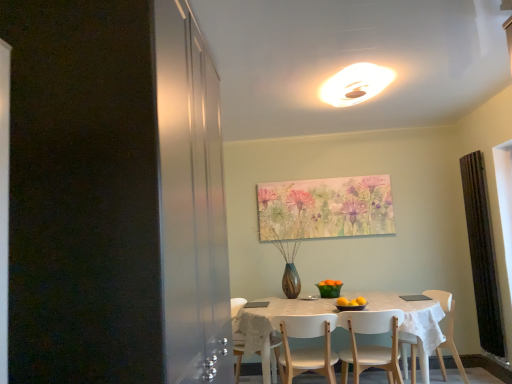
Question: Does white matte chair at lower center, which appears as the 2th chair when viewed from the right, appear on the left side of white glossy light fixture at upper center?

Choices:
 (A) no
 (B) yes

Answer: (A)

Question: Is white matte chair at lower center, marked as the 2th chair in a left-to-right arrangement, thinner than white glossy light fixture at upper center?

Choices:
 (A) yes
 (B) no

Answer: (A)

Question: Does white matte chair at lower center, marked as the 2th chair in a left-to-right arrangement, lie behind white glossy light fixture at upper center?

Choices:
 (A) yes
 (B) no

Answer: (B)

Question: From the image's perspective, would you say white matte chair at lower center, marked as the 2th chair in a left-to-right arrangement, is positioned over white glossy light fixture at upper center?

Choices:
 (A) yes
 (B) no

Answer: (B)

Question: Is white matte chair at lower center, marked as the 2th chair in a left-to-right arrangement, not within white glossy light fixture at upper center?

Choices:
 (A) no
 (B) yes

Answer: (B)

Question: Does white matte chair at lower center, which appears as the 2th chair when viewed from the right, have a greater height compared to white glossy light fixture at upper center?

Choices:
 (A) yes
 (B) no

Answer: (A)

Question: Is the surface of white matte chair at lower center, which appears as the 2th chair when viewed from the right, in direct contact with black textured curtain at right?

Choices:
 (A) no
 (B) yes

Answer: (A)

Question: Does white matte chair at lower center, marked as the 2th chair in a left-to-right arrangement, have a lesser width compared to black textured curtain at right?

Choices:
 (A) yes
 (B) no

Answer: (B)

Question: Is white matte chair at lower center, marked as the 2th chair in a left-to-right arrangement, oriented towards black textured curtain at right?

Choices:
 (A) no
 (B) yes

Answer: (A)

Question: Is white matte chair at lower center, marked as the 2th chair in a left-to-right arrangement, bigger than black textured curtain at right?

Choices:
 (A) yes
 (B) no

Answer: (A)

Question: Is white matte chair at lower center, marked as the 2th chair in a left-to-right arrangement, to the right of black textured curtain at right from the viewer's perspective?

Choices:
 (A) no
 (B) yes

Answer: (A)

Question: From a real-world perspective, is white matte chair at lower center, which appears as the 2th chair when viewed from the right, on black textured curtain at right?

Choices:
 (A) yes
 (B) no

Answer: (B)

Question: Is white glossy light fixture at upper center further to camera compared to black textured curtain at right?

Choices:
 (A) no
 (B) yes

Answer: (A)